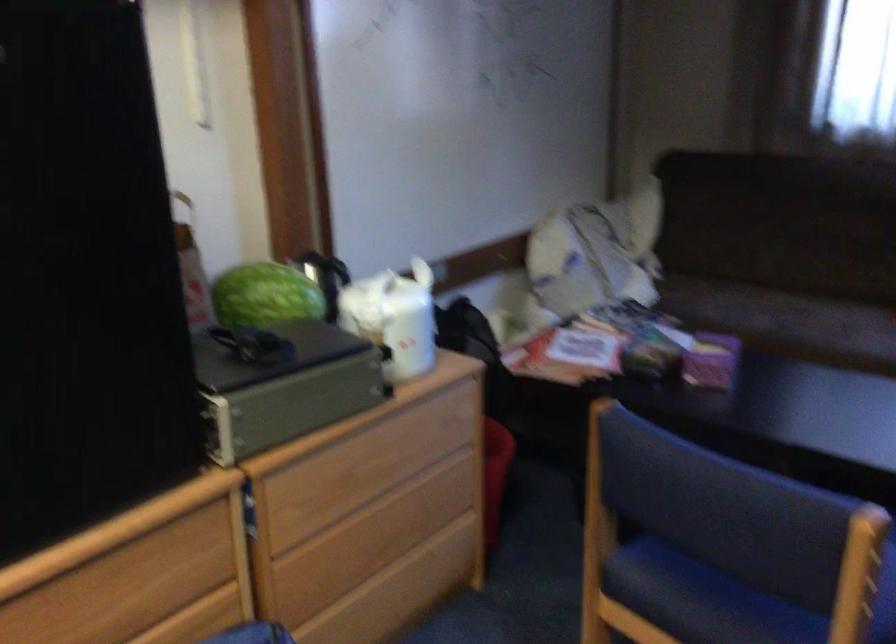
Image resolution: width=896 pixels, height=644 pixels. What do you see at coordinates (222, 433) in the screenshot?
I see `a silver case latch` at bounding box center [222, 433].